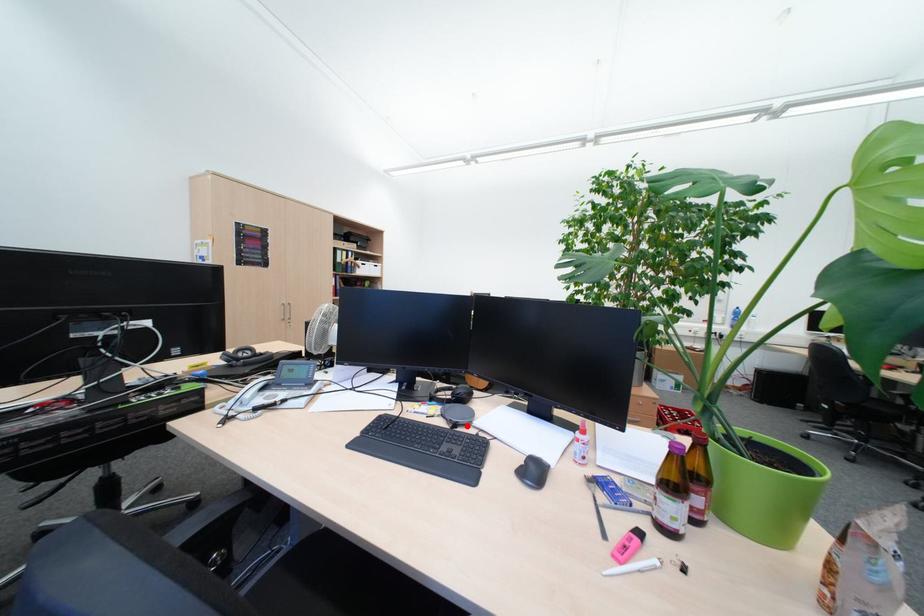
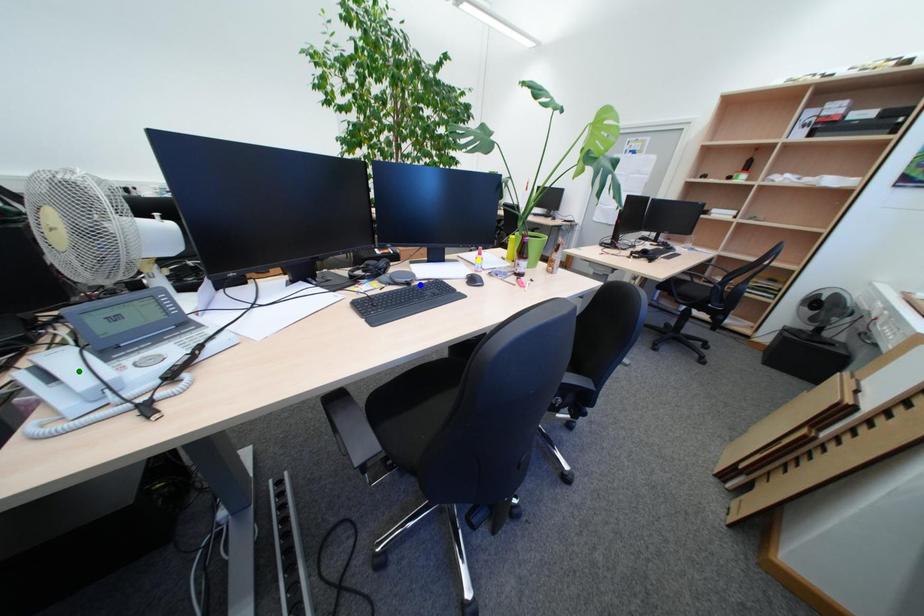
Question: I am providing you with two images of the same scene from different viewpoints. A red point is marked on the first image. You are given multiple points on the second image. Which point in image 2 represents the same 3d spot as the red point in image 1?

Choices:
 (A) green point
 (B) yellow point
 (C) blue point

Answer: (C)